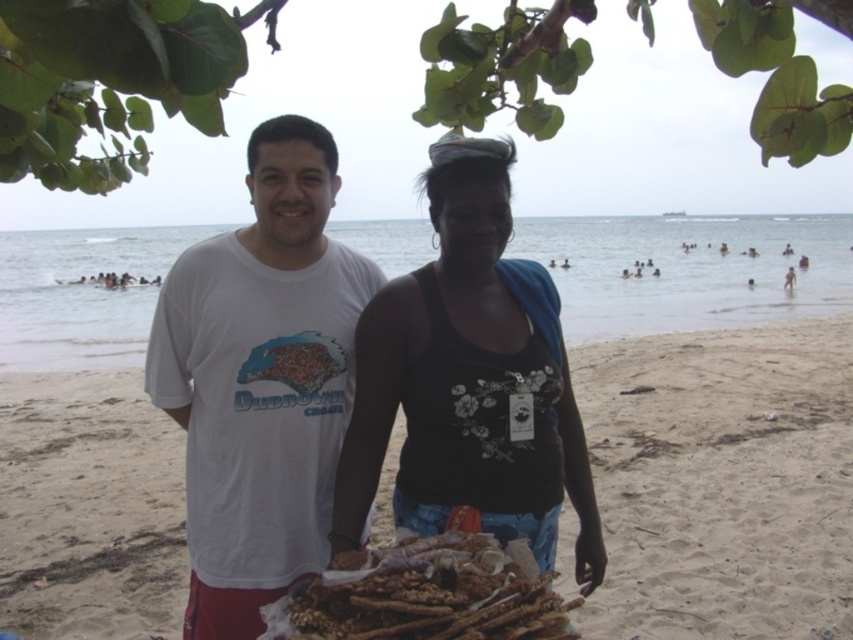
Can you confirm if brown sandy beach at center is bigger than floral printed tank top at center?

Yes.

Which is below, brown sandy beach at center or floral printed tank top at center?

brown sandy beach at center is lower down.

Find the location of a particular element. This screenshot has height=640, width=853. brown sandy beach at center is located at coordinates (722, 481).

Consider the image. Can you confirm if white cotton t-shirt at center is shorter than green leafy tree at upper center?

Correct, white cotton t-shirt at center is not as tall as green leafy tree at upper center.

Who is shorter, white cotton t-shirt at center or green leafy tree at upper center?

Standing shorter between the two is white cotton t-shirt at center.

Measure the distance between white cotton t-shirt at center and camera.

white cotton t-shirt at center is 2.40 meters away from camera.

Image resolution: width=853 pixels, height=640 pixels. In order to click on white cotton t-shirt at center in this screenshot , I will do `click(260, 380)`.

How much distance is there between green leafy tree at upper center and brown textured breadsticks at center?

4.28 feet

This screenshot has height=640, width=853. I want to click on green leafy tree at upper center, so click(112, 80).